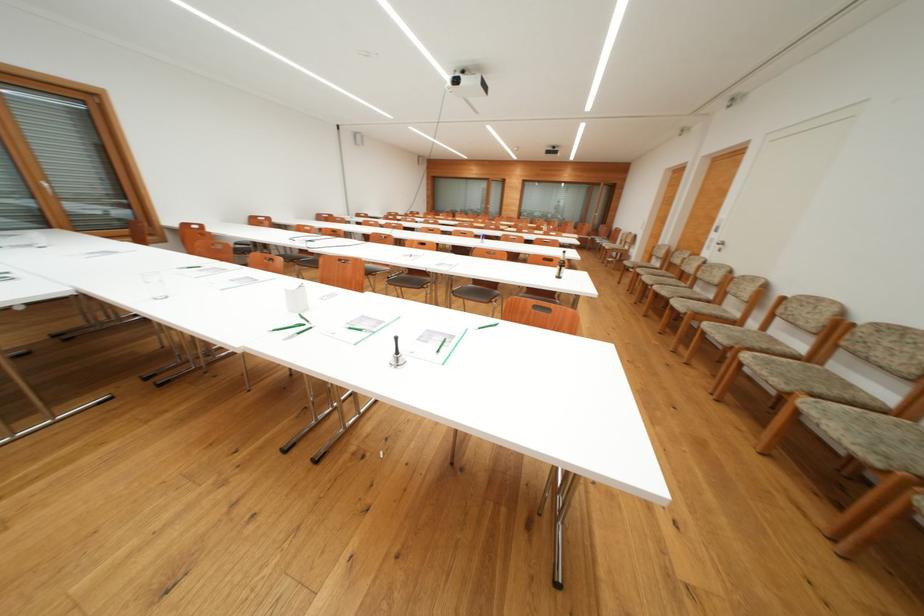
Where would you lift the white paper dispenser? Please return your answer as a coordinate pair (x, y).

(296, 298)